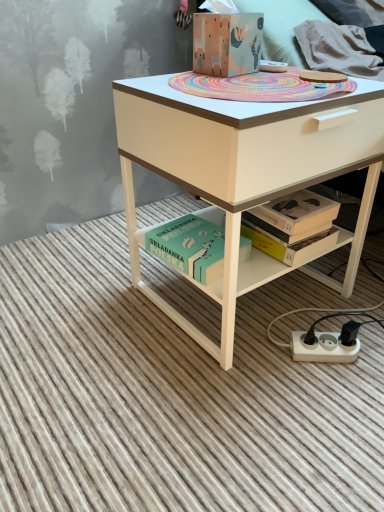
The width and height of the screenshot is (384, 512). Identify the location of wooden painted box at center. (227, 42).

Does wooden painted box at center have a larger size compared to white plastic power plugs and sockets at lower right?

Yes, wooden painted box at center is bigger than white plastic power plugs and sockets at lower right.

Is wooden painted box at center further to camera compared to white plastic power plugs and sockets at lower right?

No, the depth of wooden painted box at center is less than that of white plastic power plugs and sockets at lower right.

Is wooden painted box at center taller than white plastic power plugs and sockets at lower right?

Yes.

Is wooden painted box at center aimed at white plastic power plugs and sockets at lower right?

No, wooden painted box at center is not turned towards white plastic power plugs and sockets at lower right.

Based on the photo, does matte white desk at center come behind green matte book at lower center?

No, matte white desk at center is in front of green matte book at lower center.

Looking at this image, based on their sizes in the image, would you say matte white desk at center is bigger or smaller than green matte book at lower center?

In the image, matte white desk at center appears to be larger than green matte book at lower center.

Is matte white desk at center facing towards green matte book at lower center?

No, matte white desk at center is not turned towards green matte book at lower center.

From a real-world perspective, is matte white desk at center on green matte book at lower center?

Yes, from a real-world perspective, matte white desk at center is above green matte book at lower center.

Does point (328, 359) lie behind point (241, 127)?

That is True.

Considering the positions of objects white plastic power plugs and sockets at lower right and matte white desk at center in the image provided, who is more to the right, white plastic power plugs and sockets at lower right or matte white desk at center?

From the viewer's perspective, white plastic power plugs and sockets at lower right appears more on the right side.

Which object is closer to the camera, white plastic power plugs and sockets at lower right or matte white desk at center?

matte white desk at center is more forward.

From the image's perspective, who appears lower, white plastic power plugs and sockets at lower right or green matte book at lower center?

white plastic power plugs and sockets at lower right appears lower in the image.

Between white plastic power plugs and sockets at lower right and green matte book at lower center, which one is positioned behind?

white plastic power plugs and sockets at lower right is behind.

In terms of height, does white plastic power plugs and sockets at lower right look taller or shorter compared to green matte book at lower center?

In the image, white plastic power plugs and sockets at lower right appears to be shorter than green matte book at lower center.

Which object is thinner, white plastic power plugs and sockets at lower right or green matte book at lower center?

With smaller width is white plastic power plugs and sockets at lower right.

Is green matte book at lower center wider or thinner than matte white desk at center?

In the image, green matte book at lower center appears to be more narrow than matte white desk at center.

Is green matte book at lower center situated inside matte white desk at center or outside?

green matte book at lower center exists entirely within matte white desk at center.

Where is `book directly beneath the matte white desk at center (from a real-world perspective)`? book directly beneath the matte white desk at center (from a real-world perspective) is located at coordinates (190, 247).

Who is shorter, wooden painted box at center or matte white desk at center?

wooden painted box at center.

Considering the sizes of objects wooden painted box at center and matte white desk at center in the image provided, who is smaller, wooden painted box at center or matte white desk at center?

With smaller size is wooden painted box at center.

From the image's perspective, would you say wooden painted box at center is shown under matte white desk at center?

No, from the image's perspective, wooden painted box at center is not below matte white desk at center.

At what (x,y) coordinates should I click in order to perform the action: click on box above the matte white desk at center (from the image's perspective). Please return your answer as a coordinate pair (x, y). The width and height of the screenshot is (384, 512). Looking at the image, I should click on (227, 42).

Measure the distance from matte white desk at center to wooden painted box at center.

11.77 inches.

Is matte white desk at center inside the boundaries of wooden painted box at center, or outside?

matte white desk at center is outside wooden painted box at center.

Is matte white desk at center next to wooden painted box at center and touching it?

No, matte white desk at center is not making contact with wooden painted box at center.

Visually, is matte white desk at center positioned to the left or to the right of wooden painted box at center?

Clearly, matte white desk at center is on the right of wooden painted box at center in the image.

Locate an element on the screen. The height and width of the screenshot is (512, 384). power plugs and sockets on the right of wooden painted box at center is located at coordinates (323, 348).

Where is `desk above the green matte book at lower center (from a real-world perspective)`? desk above the green matte book at lower center (from a real-world perspective) is located at coordinates (245, 170).

Looking at the image, which one is located closer to white plastic power plugs and sockets at lower right, wooden painted box at center or matte white desk at center?

matte white desk at center is positioned closer to the anchor white plastic power plugs and sockets at lower right.

Estimate the real-world distances between objects in this image. Which object is further from matte white desk at center, green matte book at lower center or wooden painted box at center?

wooden painted box at center lies further to matte white desk at center than the other object.

Based on their spatial positions, is matte white desk at center or wooden painted box at center further from white plastic power plugs and sockets at lower right?

wooden painted box at center is further to white plastic power plugs and sockets at lower right.

Considering their positions, is matte white desk at center positioned closer to white plastic power plugs and sockets at lower right than green matte book at lower center?

green matte book at lower center is positioned closer to the anchor white plastic power plugs and sockets at lower right.

In the scene shown: When comparing their distances from matte white desk at center, does white plastic power plugs and sockets at lower right or wooden painted box at center seem further?

white plastic power plugs and sockets at lower right is positioned further to the anchor matte white desk at center.

Based on their spatial positions, is matte white desk at center or green matte book at lower center closer to wooden painted box at center?

matte white desk at center.

Estimate the real-world distances between objects in this image. Which object is closer to matte white desk at center, white plastic power plugs and sockets at lower right or green matte book at lower center?

The object closer to matte white desk at center is green matte book at lower center.

When comparing their distances from green matte book at lower center, does white plastic power plugs and sockets at lower right or wooden painted box at center seem further?

Based on the image, wooden painted box at center appears to be further to green matte book at lower center.

Find the location of a particular element. book between matte white desk at center and white plastic power plugs and sockets at lower right in the up-down direction is located at coordinates (190, 247).

Find the location of a particular element. The width and height of the screenshot is (384, 512). desk between wooden painted box at center and white plastic power plugs and sockets at lower right in the up-down direction is located at coordinates pos(245,170).

At what (x,y) coordinates should I click in order to perform the action: click on desk between wooden painted box at center and green matte book at lower center in the vertical direction. Please return your answer as a coordinate pair (x, y). Looking at the image, I should click on (245, 170).

The image size is (384, 512). I want to click on book that lies between wooden painted box at center and white plastic power plugs and sockets at lower right from top to bottom, so click(x=190, y=247).